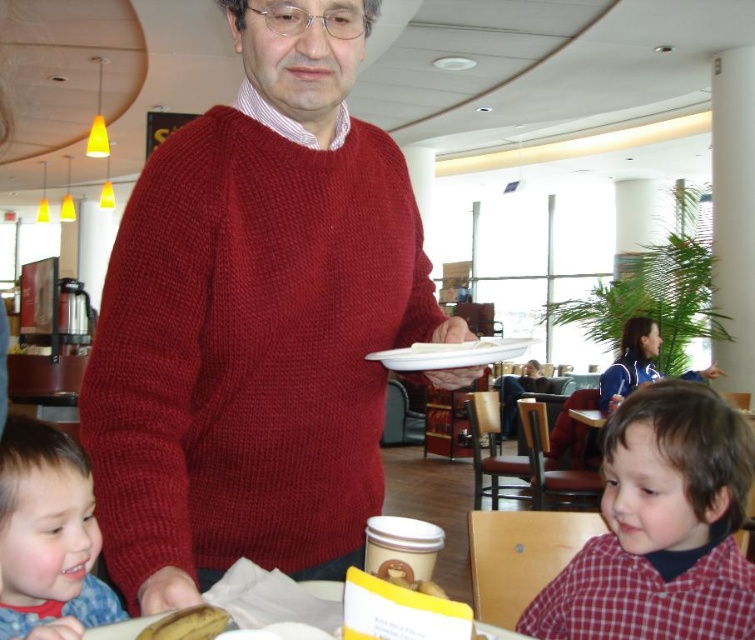
Which of these two, red checkered shirt at lower right or yellow matte banana at lower left, stands taller?

red checkered shirt at lower right

Is red checkered shirt at lower right below yellow matte banana at lower left?

Yes.

Locate an element on the screen. The height and width of the screenshot is (640, 755). red checkered shirt at lower right is located at coordinates (661, 528).

Is smooth red shirt at lower left wider than white matte plate at center?

No, smooth red shirt at lower left is not wider than white matte plate at center.

Which is above, smooth red shirt at lower left or white matte plate at center?

Positioned higher is white matte plate at center.

Locate an element on the screen. smooth red shirt at lower left is located at coordinates (48, 532).

Locate an element on the screen. smooth red shirt at lower left is located at coordinates (48, 532).

Who is more distant from viewer, (211, 228) or (752, 438)?

Result: The point (752, 438) is more distant.

Can you confirm if knitted red sweater at center is positioned above red checkered shirt at lower right?

Indeed, knitted red sweater at center is positioned over red checkered shirt at lower right.

You are a GUI agent. You are given a task and a screenshot of the screen. Output one action in this format:
    pyautogui.click(x=<x>, y=<y>)
    Task: Click on the knitted red sweater at center
    
    Given the screenshot: What is the action you would take?
    pyautogui.click(x=254, y=321)